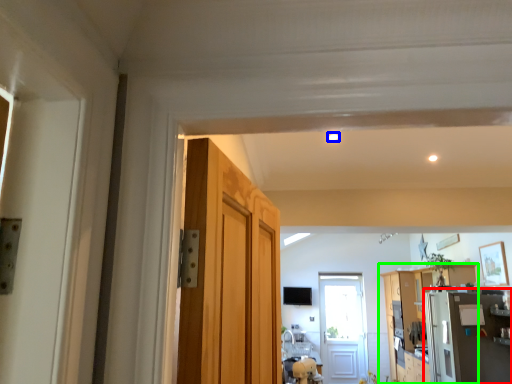
Question: Which object is positioned farthest from appliance (highlighted by a red box)? Select from light (highlighted by a blue box) and cabinetry (highlighted by a green box).

Choices:
 (A) light
 (B) cabinetry

Answer: (A)